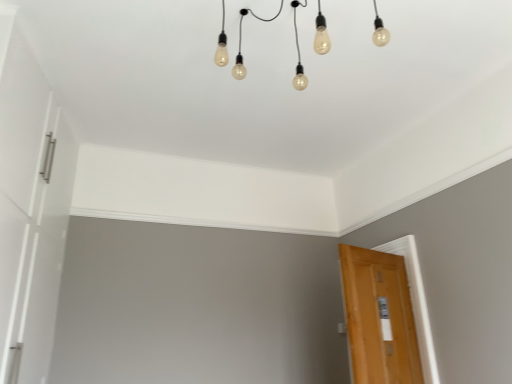
This screenshot has width=512, height=384. I want to click on wooden door at lower right, so click(379, 317).

Measure the distance between point (x=397, y=279) and camera.

3.28 meters.

Describe the element at coordinates (379, 317) in the screenshot. This screenshot has width=512, height=384. I see `wooden door at lower right` at that location.

This screenshot has width=512, height=384. In order to click on wooden door at lower right in this screenshot , I will do `click(379, 317)`.